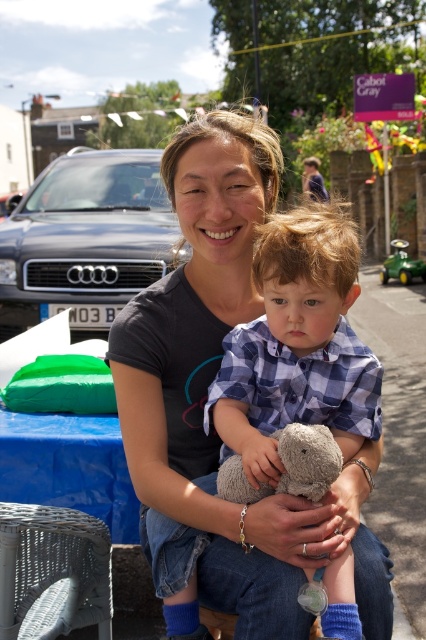
Measure the distance between point (250, 340) and camera.

Point (250, 340) and camera are 1.83 meters apart.

Can you confirm if blue checkered shirt at center is wider than fuzzy gray teddy bear at center?

Yes.

Locate an element on the screen. The width and height of the screenshot is (426, 640). blue checkered shirt at center is located at coordinates (298, 346).

Is fuzzy gray teddy bear at center positioned behind green plastic toy car at right?

No.

This screenshot has width=426, height=640. I want to click on fuzzy gray teddy bear at center, so click(x=287, y=467).

The width and height of the screenshot is (426, 640). I want to click on fuzzy gray teddy bear at center, so click(x=287, y=467).

Between blue checkered shirt at center and green plastic toy car at right, which one has less height?

blue checkered shirt at center is shorter.

Is point (359, 444) positioned after point (402, 260)?

That is False.

Does point (288, 272) come farther from viewer compared to point (408, 241)?

No, it is not.

Locate an element on the screen. blue checkered shirt at center is located at coordinates click(298, 346).